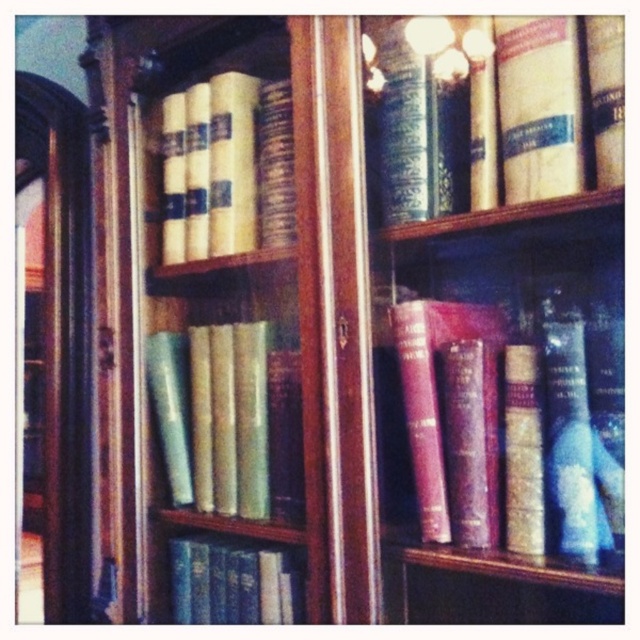
Which of these two, maroon leather book at center or hardcover book at center, stands shorter?

hardcover book at center is shorter.

Does maroon leather book at center have a larger size compared to hardcover book at center?

Indeed, maroon leather book at center has a larger size compared to hardcover book at center.

Is point (598, 372) more distant than point (260, 577)?

That is False.

At what (x,y) coordinates should I click in order to perform the action: click on maroon leather book at center. Please return your answer as a coordinate pair (x, y). Looking at the image, I should click on (516, 420).

Which is more to the left, hardcover book at upper center or hardcover book at center?

From the viewer's perspective, hardcover book at center appears more on the left side.

Which is more to the right, hardcover book at upper center or hardcover book at center?

hardcover book at upper center is more to the right.

Locate an element on the screen. The image size is (640, 640). hardcover book at upper center is located at coordinates (493, 109).

Is hardcover book at upper center to the right of yellowish matte book at upper left from the viewer's perspective?

Correct, you'll find hardcover book at upper center to the right of yellowish matte book at upper left.

Is hardcover book at upper center smaller than yellowish matte book at upper left?

Actually, hardcover book at upper center might be larger than yellowish matte book at upper left.

In order to click on hardcover book at upper center in this screenshot , I will do `click(493, 109)`.

At what (x,y) coordinates should I click in order to perform the action: click on hardcover book at upper center. Please return your answer as a coordinate pair (x, y). The width and height of the screenshot is (640, 640). Looking at the image, I should click on (493, 109).